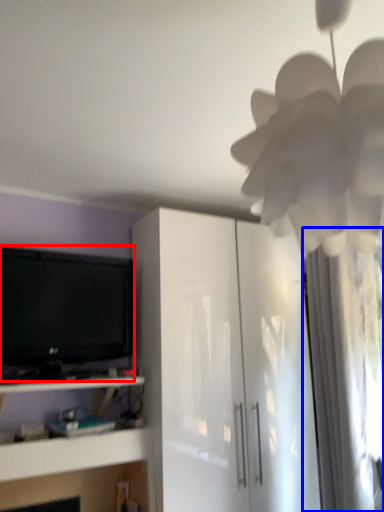
Question: Among these objects, which one is farthest to the camera, television (highlighted by a red box) or curtain (highlighted by a blue box)?

Choices:
 (A) television
 (B) curtain

Answer: (B)